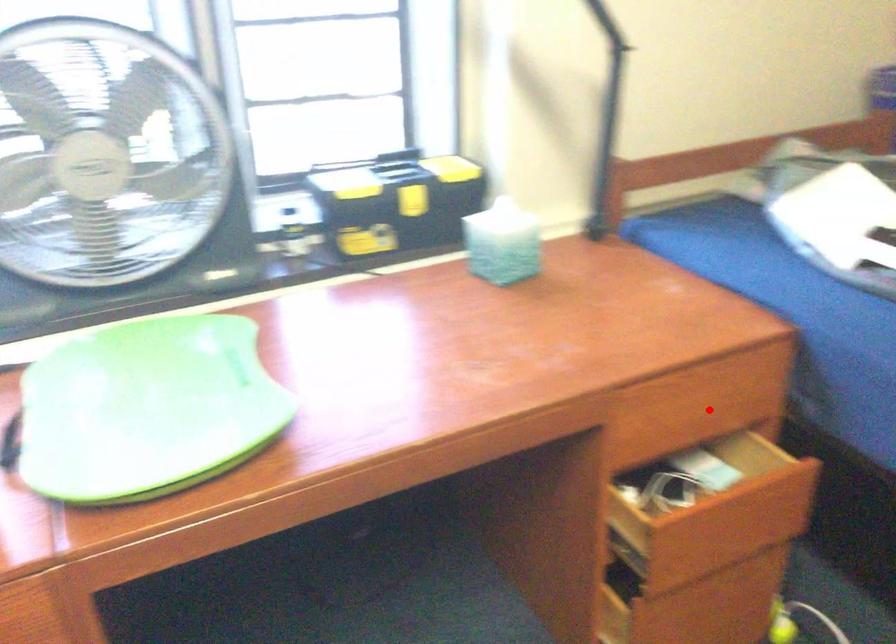
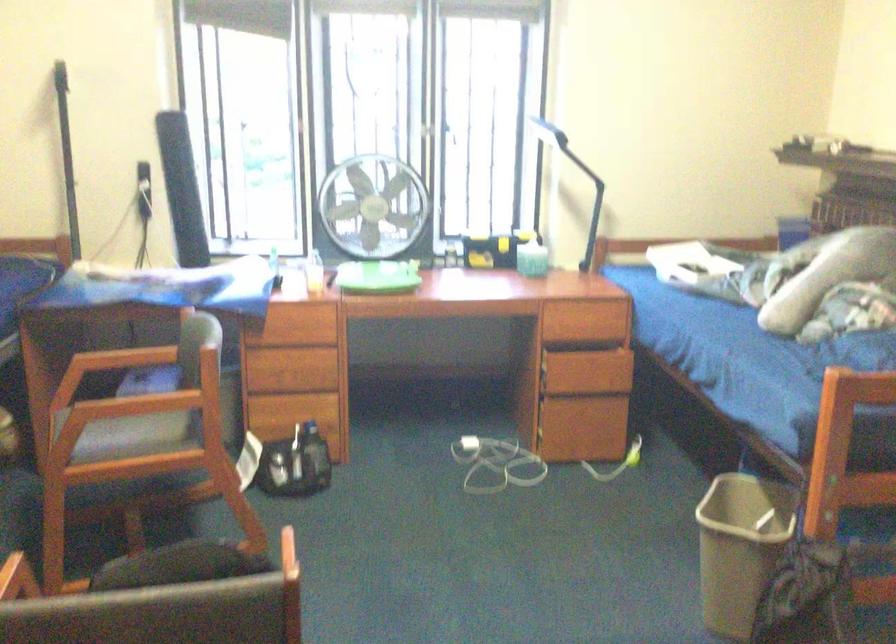
Locate, in the second image, the point that corresponds to the highlighted location in the first image.

(596, 319)